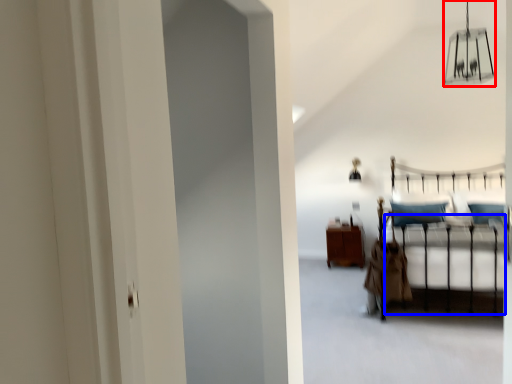
Question: Among these objects, which one is nearest to the camera, lamp (highlighted by a red box) or bed frame (highlighted by a blue box)?

Choices:
 (A) lamp
 (B) bed frame

Answer: (A)